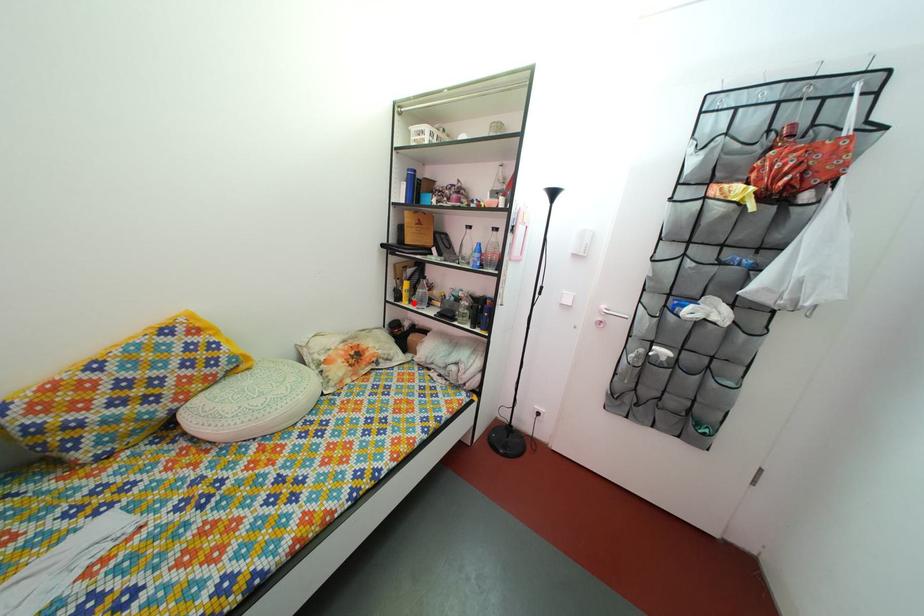
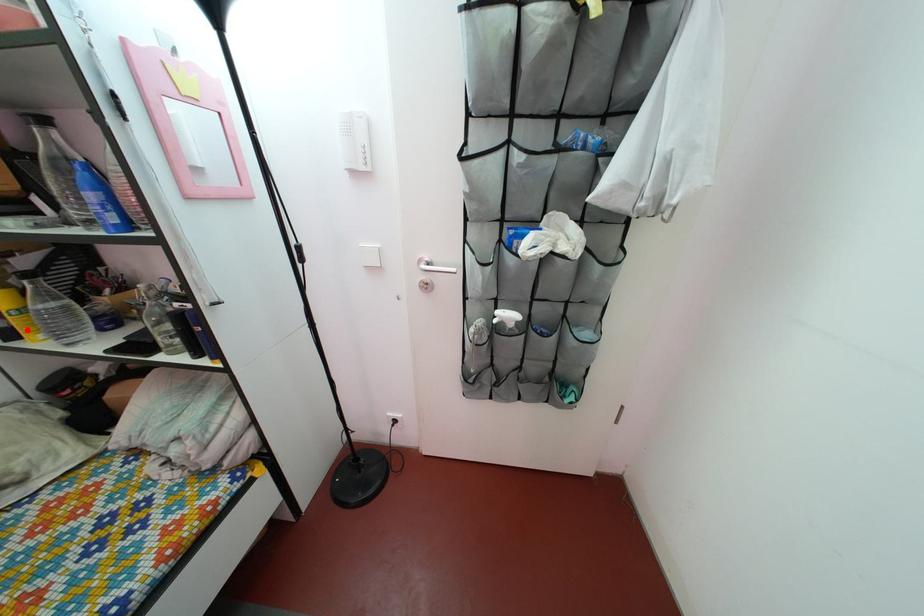
I am providing you with two images of the same scene from different viewpoints. A red point is marked on the first image and another point is marked on the second image. Are the points marked in image1 and image2 representing the same 3D position?

Yes